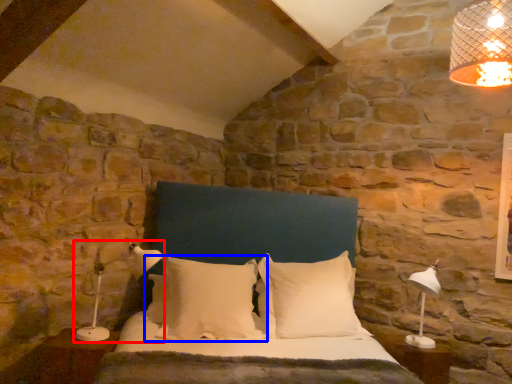
Question: Among these objects, which one is farthest to the camera, lamp (highlighted by a red box) or pillow (highlighted by a blue box)?

Choices:
 (A) lamp
 (B) pillow

Answer: (B)